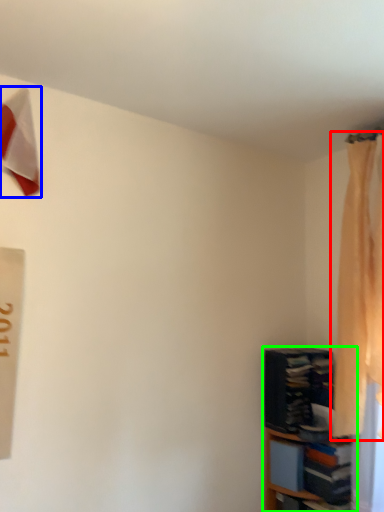
Question: Which is nearer to the curtain (highlighted by a red box)? twin (highlighted by a blue box) or shelf (highlighted by a green box).

Choices:
 (A) twin
 (B) shelf

Answer: (B)